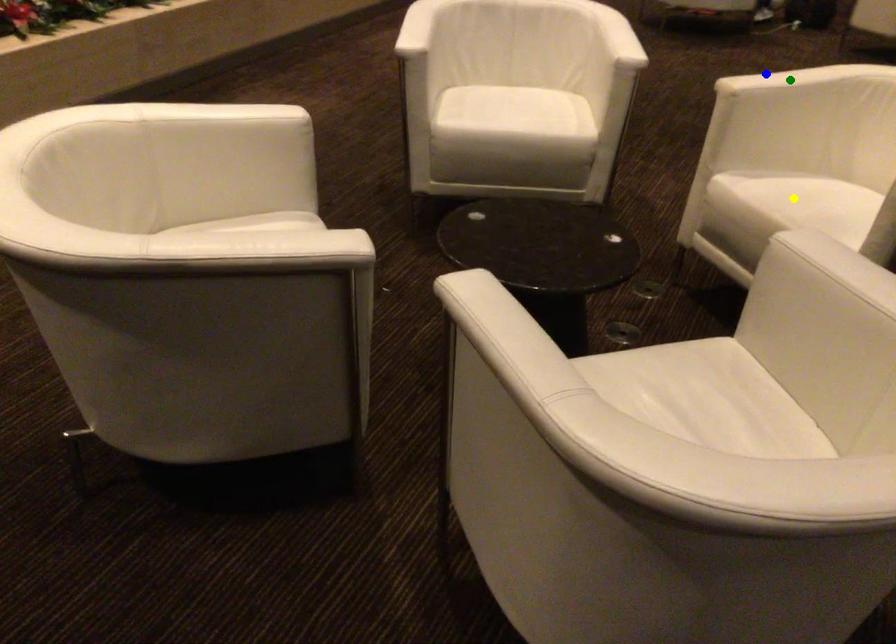
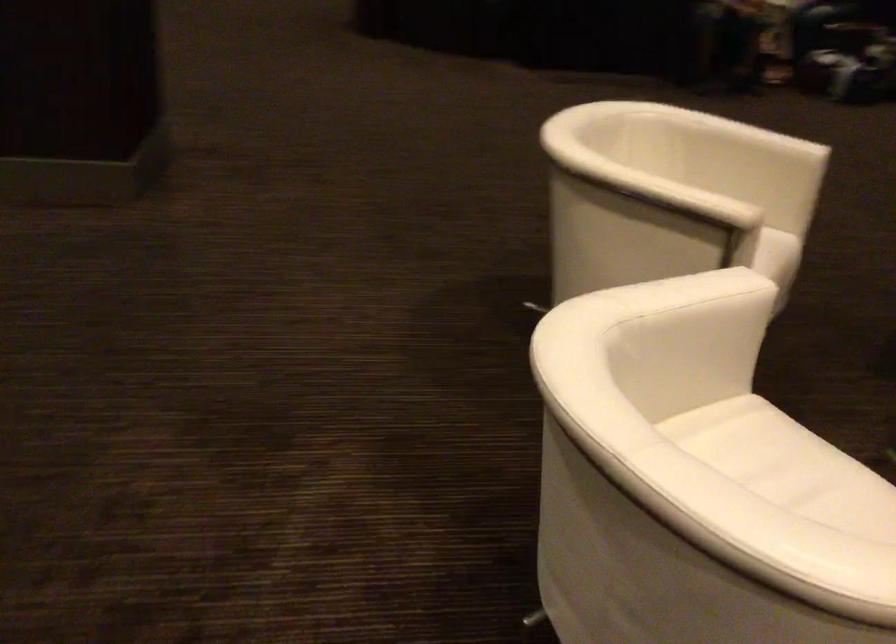
I am providing you with two images of the same scene from different viewpoints. Three points are marked in image1. Which point corresponds to a part or object that is occluded in image2?In image1, three points are marked. Which of them correspond to a part or object that is occluded in image2?Among the three points shown in image1, which one corresponds to a part or object that is no longer visible due to occlusion in image2?

yellow point, green point cannot be seen in image2.